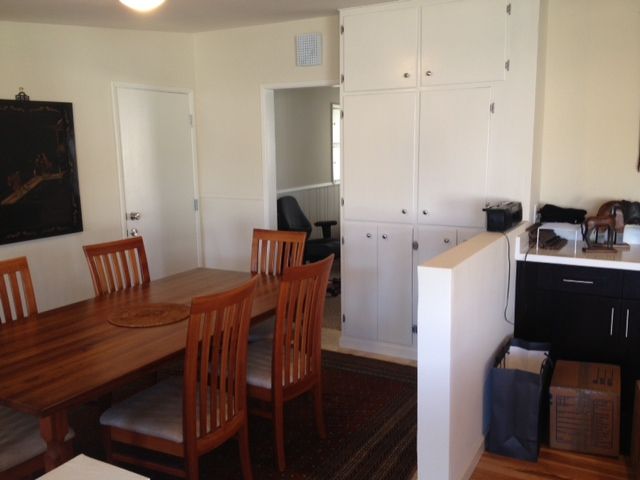
Locate an element on the screen. light beige walls is located at coordinates (569, 157), (235, 137), (79, 75), (211, 17).